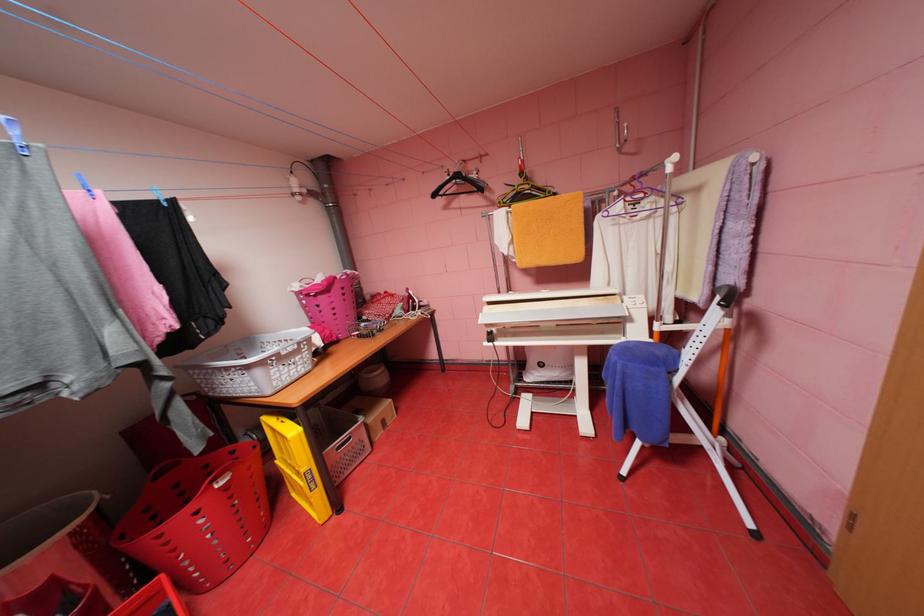
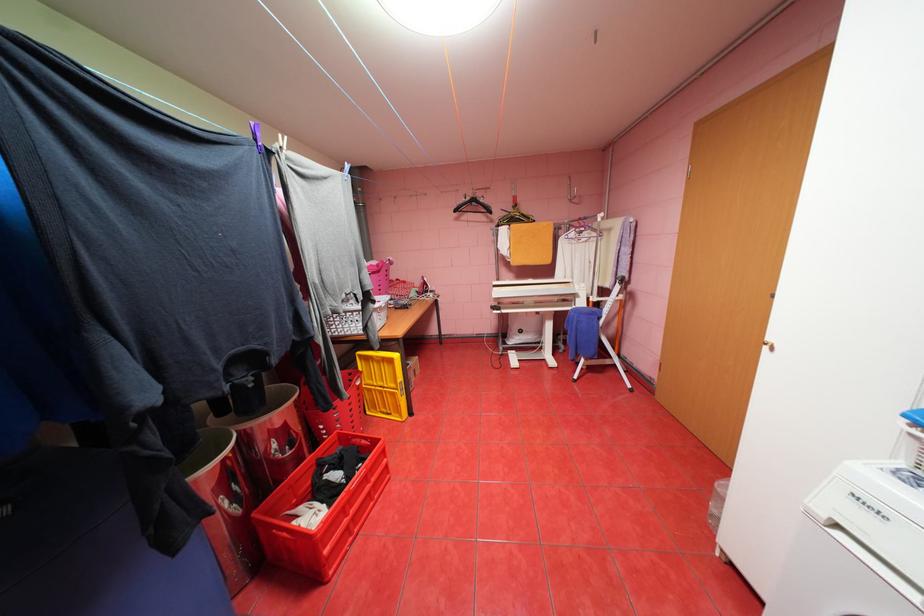
Where in the second image is the point corresponding to (x=443, y=195) from the first image?

(464, 209)